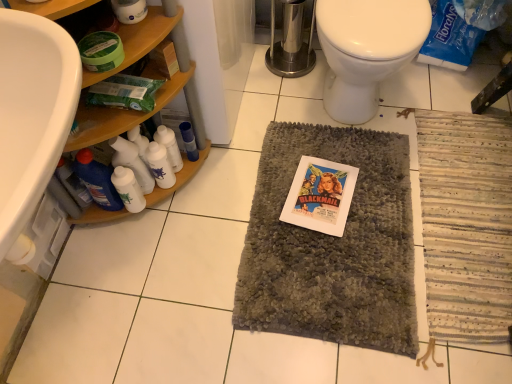
Image resolution: width=512 pixels, height=384 pixels. I want to click on free space between white glossy bottles at left, the 3th bottle in the left-to-right sequence, and striped fabric bath mat at lower right, so click(349, 215).